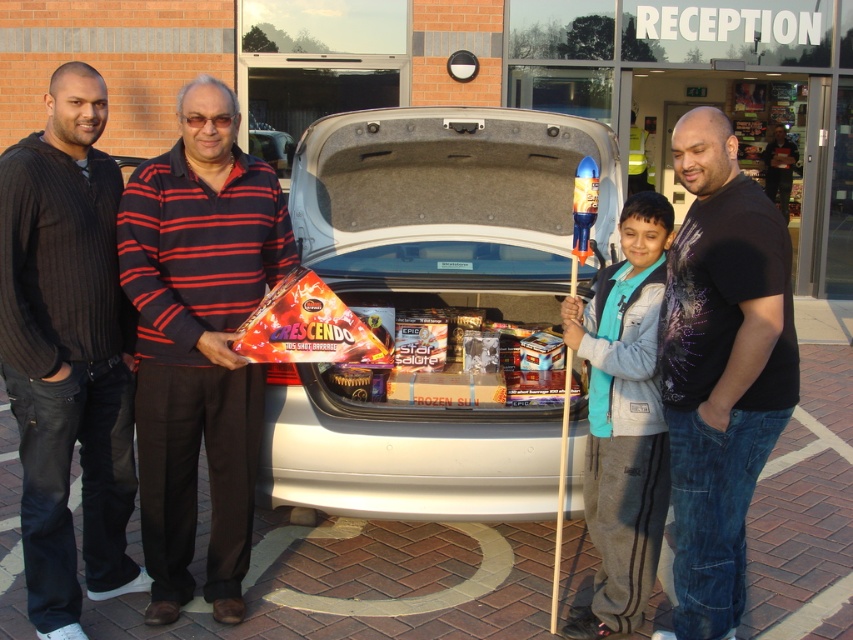
Is silver metallic car trunk at center smaller than dark brown sweater at left?

No.

Between silver metallic car trunk at center and dark brown sweater at left, which one appears on the left side from the viewer's perspective?

dark brown sweater at left

Who is more distant from viewer, (369,403) or (62,609)?

Positioned behind is point (369,403).

This screenshot has height=640, width=853. What are the coordinates of `silver metallic car trunk at center` in the screenshot? It's located at (433, 307).

The height and width of the screenshot is (640, 853). I want to click on striped sweater at center, so click(198, 340).

Is point (165, 228) positioned in front of point (82, 632)?

No, (165, 228) is behind (82, 632).

Locate an element on the screen. The height and width of the screenshot is (640, 853). striped sweater at center is located at coordinates (198, 340).

Who is positioned more to the right, dark brown sweater at left or black t-shirt at center?

From the viewer's perspective, black t-shirt at center appears more on the right side.

Find the location of `dark brown sweater at left`. dark brown sweater at left is located at coordinates (67, 353).